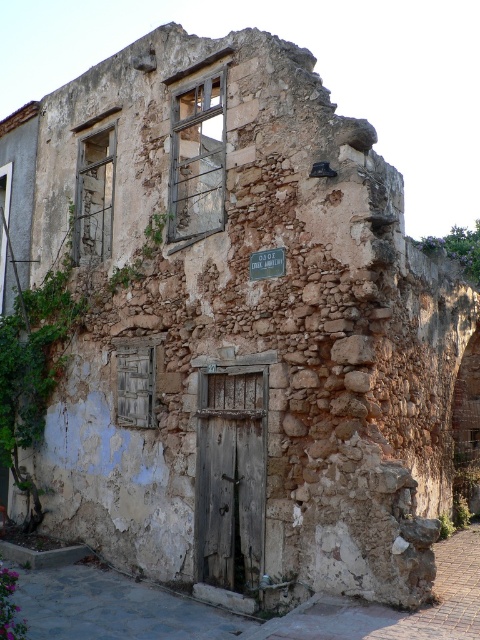
You are standing in front of the old stone building and notice two points marked on its facade. The first point is at coordinates point (214, 561) and the second is at point (272, 273). Which of these points is closer to you?

Point (272, 273) is closer to you because it is less further to the camera than point (214, 561).